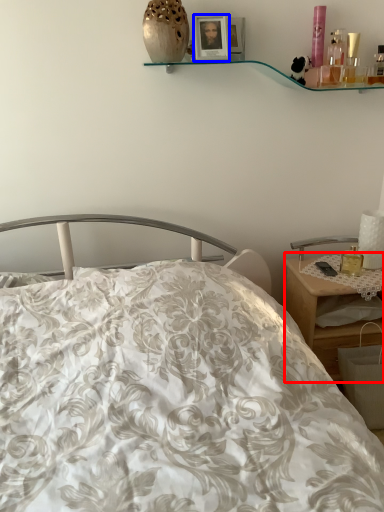
Question: Which point is further to the camera, desk (highlighted by a red box) or picture frame (highlighted by a blue box)?

Choices:
 (A) desk
 (B) picture frame

Answer: (A)